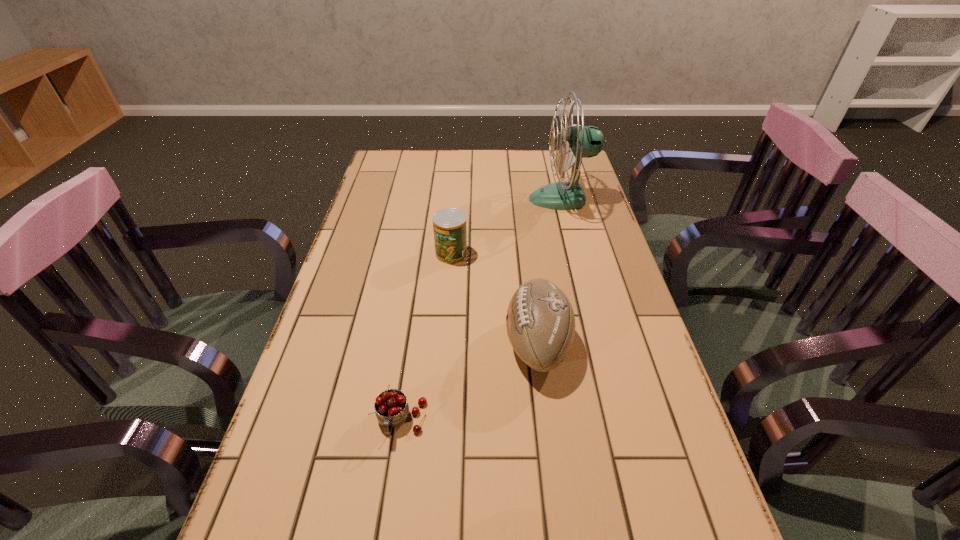
Where is `free location located in front of the farthest object, directing airflow`? free location located in front of the farthest object, directing airflow is located at coordinates (423, 199).

Image resolution: width=960 pixels, height=540 pixels. What are the coordinates of `vacant space located 0.130m on the laces of the third farthest object` in the screenshot? It's located at (449, 344).

Where is `blank space located on the laces of the third farthest object`? The height and width of the screenshot is (540, 960). blank space located on the laces of the third farthest object is located at coordinates (432, 344).

The height and width of the screenshot is (540, 960). Find the location of `free space located on the laces of the third farthest object`. free space located on the laces of the third farthest object is located at coordinates (479, 344).

Identify the location of blank space located 0.060m on the left of the second shortest object. (415, 254).

You are a GUI agent. You are given a task and a screenshot of the screen. Output one action in this format:
    pyautogui.click(x=<x>, y=<y>)
    Task: Click on the free location located on the handle side of the nearest object
    This screenshot has width=960, height=540.
    Given the screenshot: What is the action you would take?
    pyautogui.click(x=387, y=516)

The image size is (960, 540). In order to click on object that is at the far edge in this screenshot , I will do `click(579, 142)`.

Locate an element on the screen. object located at the right edge is located at coordinates (579, 142).

The width and height of the screenshot is (960, 540). In order to click on object present at the far right corner in this screenshot , I will do `click(579, 142)`.

I want to click on vacant space at the far edge, so click(x=445, y=180).